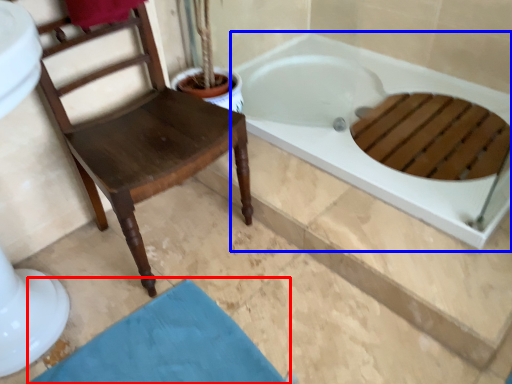
Question: Which of the following is the closest to the observer, bath mat (highlighted by a red box) or bathtub (highlighted by a blue box)?

Choices:
 (A) bath mat
 (B) bathtub

Answer: (A)